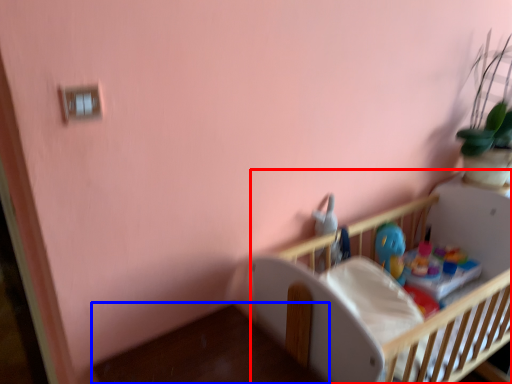
Question: Which object appears farthest to the camera in this image, infant bed (highlighted by a red box) or table (highlighted by a blue box)?

Choices:
 (A) infant bed
 (B) table

Answer: (A)